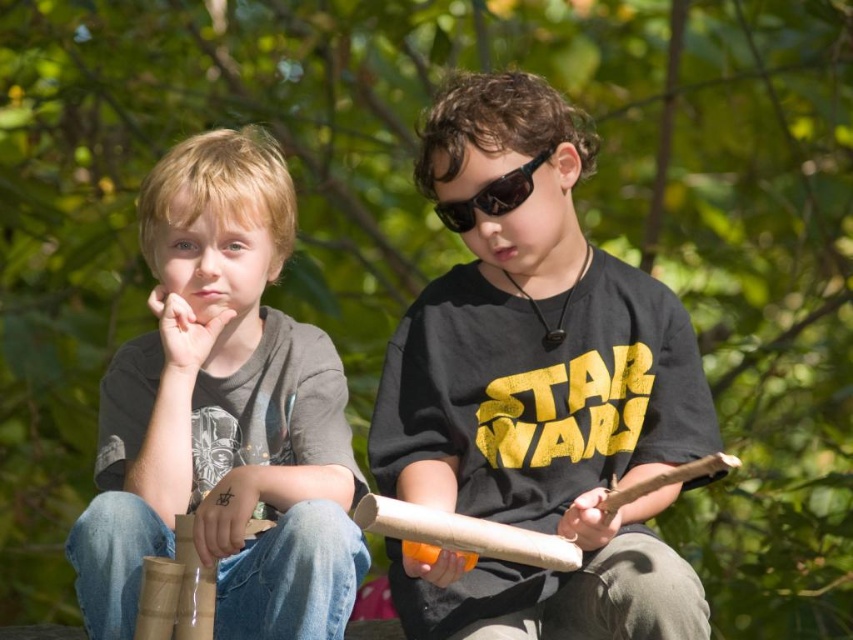
Question: Is black matte t-shirt at center to the left of black reflective sunglasses at center from the viewer's perspective?

Choices:
 (A) yes
 (B) no

Answer: (B)

Question: Is matte gray shirt at left wider than black reflective sunglasses at center?

Choices:
 (A) yes
 (B) no

Answer: (A)

Question: Is matte gray shirt at left wider than black reflective sunglasses at center?

Choices:
 (A) no
 (B) yes

Answer: (B)

Question: Estimate the real-world distances between objects in this image. Which object is farther from the black reflective sunglasses at center?

Choices:
 (A) matte gray shirt at left
 (B) black matte t-shirt at center

Answer: (A)

Question: Which is farther from the black matte t-shirt at center?

Choices:
 (A) black reflective sunglasses at center
 (B) matte gray shirt at left

Answer: (A)

Question: Which object is the farthest from the black matte t-shirt at center?

Choices:
 (A) matte gray shirt at left
 (B) black reflective sunglasses at center

Answer: (B)